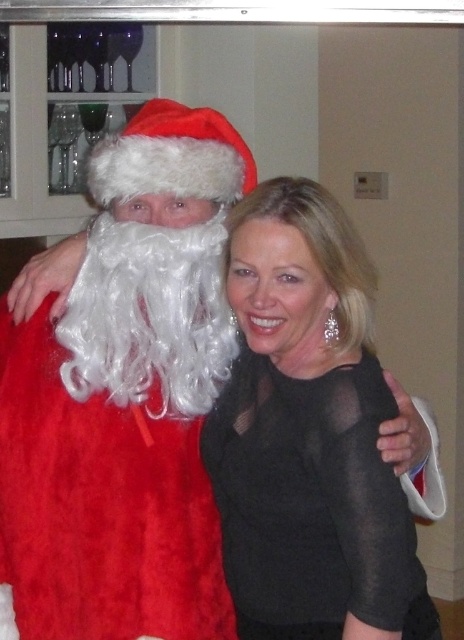
Question: Is fuzzy red santa at left bigger than fuzzy red santa hat at upper left?

Choices:
 (A) yes
 (B) no

Answer: (A)

Question: Is fuzzy red santa at left to the right of black sheer dress at center from the viewer's perspective?

Choices:
 (A) yes
 (B) no

Answer: (B)

Question: Based on their relative distances, which object is nearer to the fuzzy red santa at left?

Choices:
 (A) fuzzy red santa hat at upper left
 (B) black sheer dress at center

Answer: (B)

Question: Is fuzzy red santa at left below fuzzy red santa hat at upper left?

Choices:
 (A) no
 (B) yes

Answer: (B)

Question: Which point appears closest to the camera in this image?

Choices:
 (A) pyautogui.click(x=161, y=172)
 (B) pyautogui.click(x=283, y=266)
 (C) pyautogui.click(x=126, y=180)

Answer: (B)

Question: Based on their relative distances, which object is farther from the fuzzy red santa at left?

Choices:
 (A) fuzzy red santa hat at upper left
 (B) black sheer dress at center

Answer: (A)